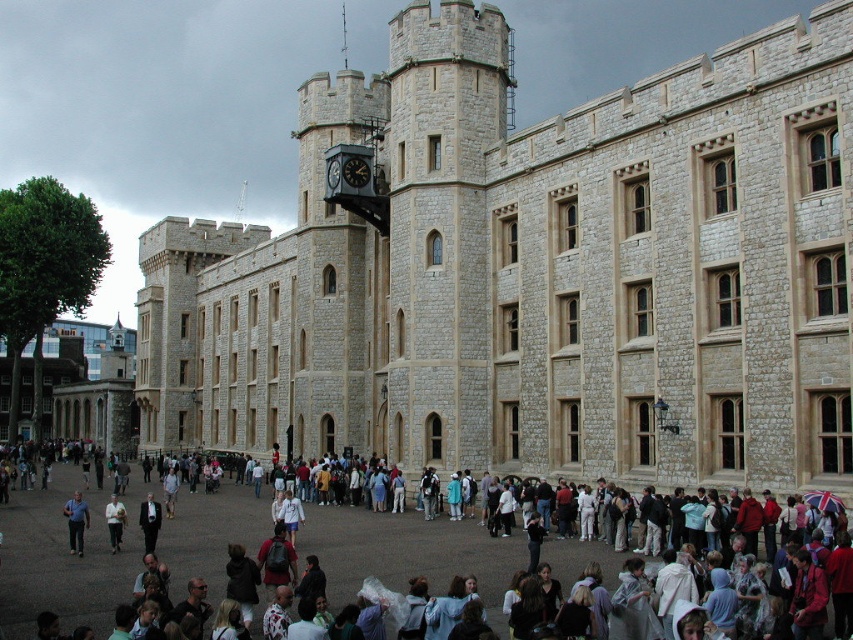
Question: Does dark suit at center have a smaller size compared to light gray fabric jacket at lower left?

Choices:
 (A) yes
 (B) no

Answer: (B)

Question: Estimate the real-world distances between objects in this image. Which object is farther from the white cotton shirt at center?

Choices:
 (A) light gray fabric jacket at lower left
 (B) dark suit at center
 (C) beige stone tower at center
 (D) blue shirt at center

Answer: (C)

Question: Is beige stone tower at center behind dark suit at center?

Choices:
 (A) no
 (B) yes

Answer: (A)

Question: Considering the relative positions of beige stone tower at center and blue shirt at center in the image provided, where is beige stone tower at center located with respect to blue shirt at center?

Choices:
 (A) above
 (B) below

Answer: (A)

Question: Among these objects, which one is nearest to the camera?

Choices:
 (A) light gray fabric jacket at lower left
 (B) beige stone tower at center

Answer: (B)

Question: Considering the real-world distances, which object is closest to the light gray fabric jacket at lower left?

Choices:
 (A) blue shirt at center
 (B) beige stone tower at center
 (C) white cotton shirt at center

Answer: (A)